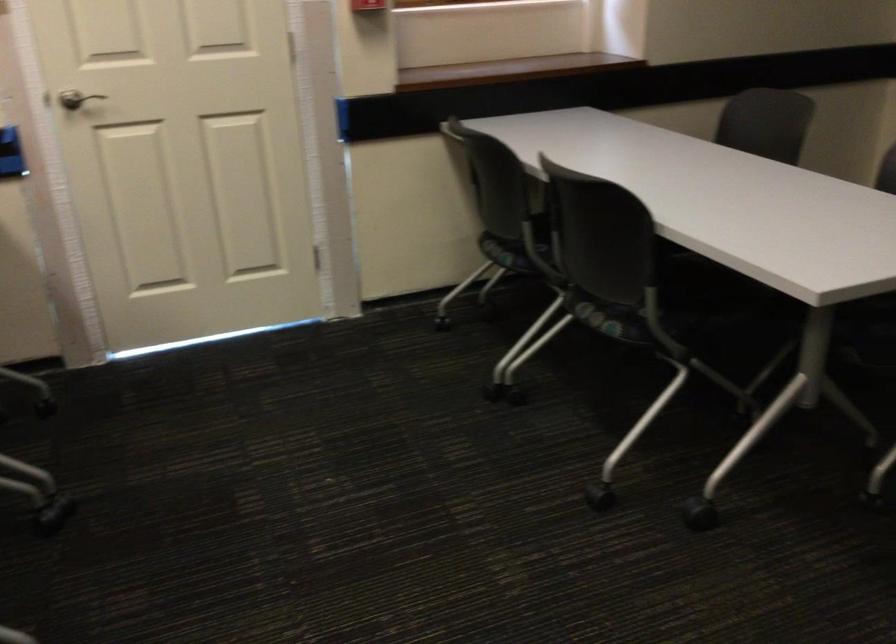
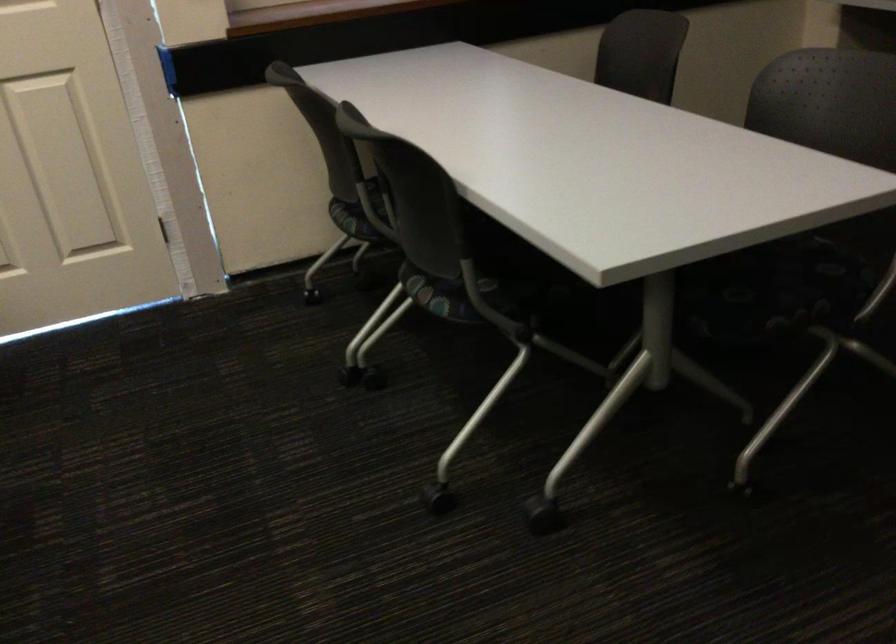
Locate, in the second image, the point that corresponds to (x=608, y=319) in the first image.

(442, 295)